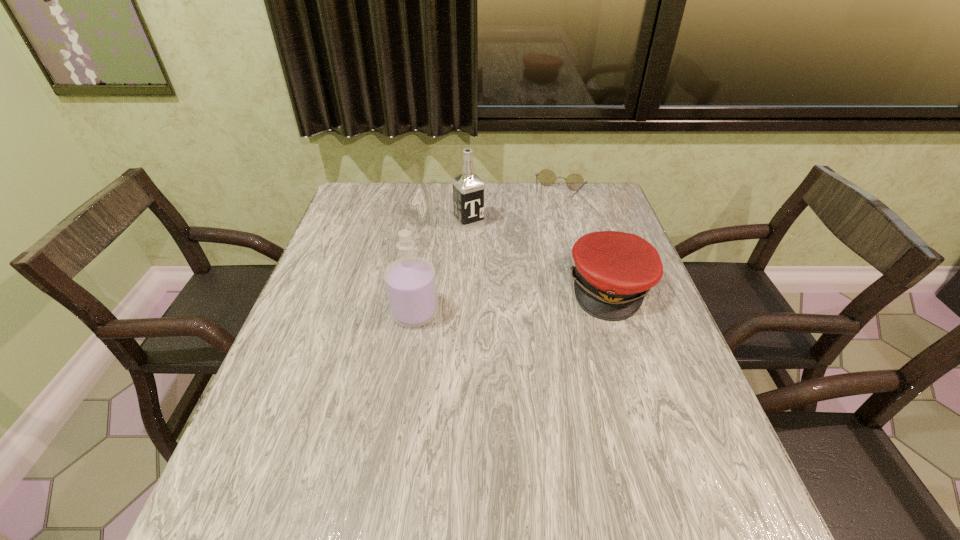
The width and height of the screenshot is (960, 540). In the image, there is a desktop. Identify the location of vacant area at the left edge. (335, 312).

In the image, there is a desktop. Identify the location of vacant space at the near left corner. tap(263, 458).

This screenshot has width=960, height=540. I want to click on vacant area at the near right corner of the desktop, so click(702, 454).

Identify the location of vacant area that lies between the second shortest object and the perfume. (513, 300).

The width and height of the screenshot is (960, 540). Identify the location of blank region between the second farthest object and the farthest object. (515, 210).

Locate an element on the screen. This screenshot has width=960, height=540. unoccupied area between the leftmost object and the third object from right to left is located at coordinates (442, 268).

Locate an element on the screen. The width and height of the screenshot is (960, 540). free area in between the second shortest object and the perfume is located at coordinates (513, 300).

You are a GUI agent. You are given a task and a screenshot of the screen. Output one action in this format:
    pyautogui.click(x=<x>, y=<y>)
    Task: Click on the vacant region between the shortest object and the second object from left to right
    The image size is (960, 540).
    Given the screenshot: What is the action you would take?
    pyautogui.click(x=515, y=210)

Locate an element on the screen. Image resolution: width=960 pixels, height=540 pixels. vacant space in between the third nearest object and the perfume is located at coordinates (442, 268).

Identify the location of free spot between the spectacles and the vodka. The height and width of the screenshot is (540, 960). (515, 210).